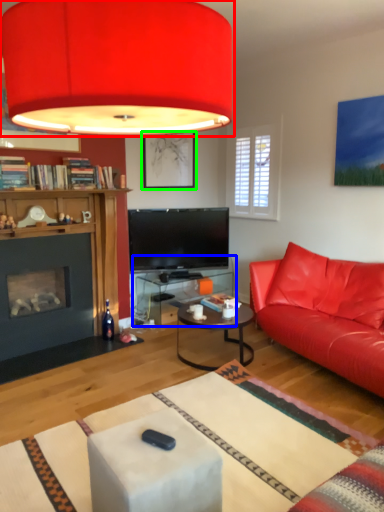
Question: Based on their relative distances, which object is farther from lamp (highlighted by a red box)? Choose from table (highlighted by a blue box) and picture frame (highlighted by a green box).

Choices:
 (A) table
 (B) picture frame

Answer: (A)